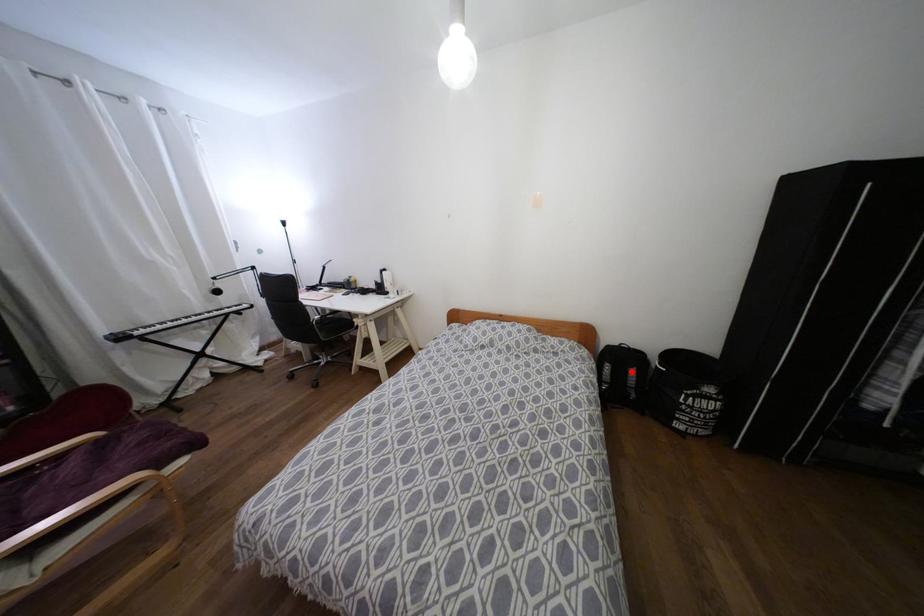
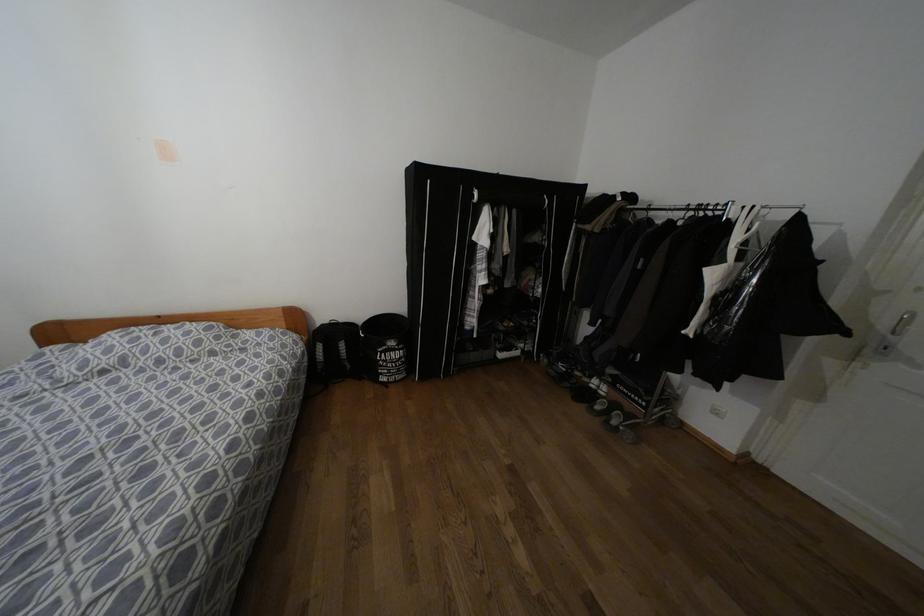
Question: I am providing you with two images of the same scene from different viewpoints. Given a red point in image1, look at the same physical point in image2. Is it:

Choices:
 (A) Closer to the viewpoint
 (B) Farther from the viewpoint

Answer: (B)